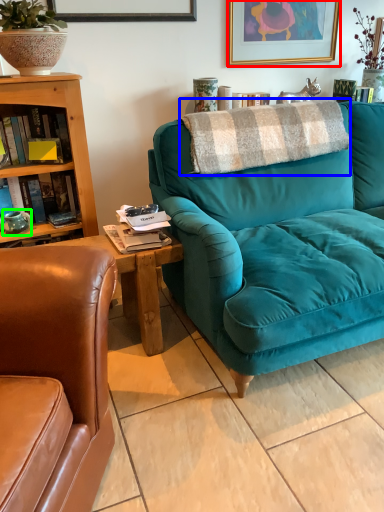
Question: Which object is positioned closest to picture frame (highlighted by a red box)? Select from blanket (highlighted by a blue box) and teal (highlighted by a green box).

Choices:
 (A) blanket
 (B) teal

Answer: (A)